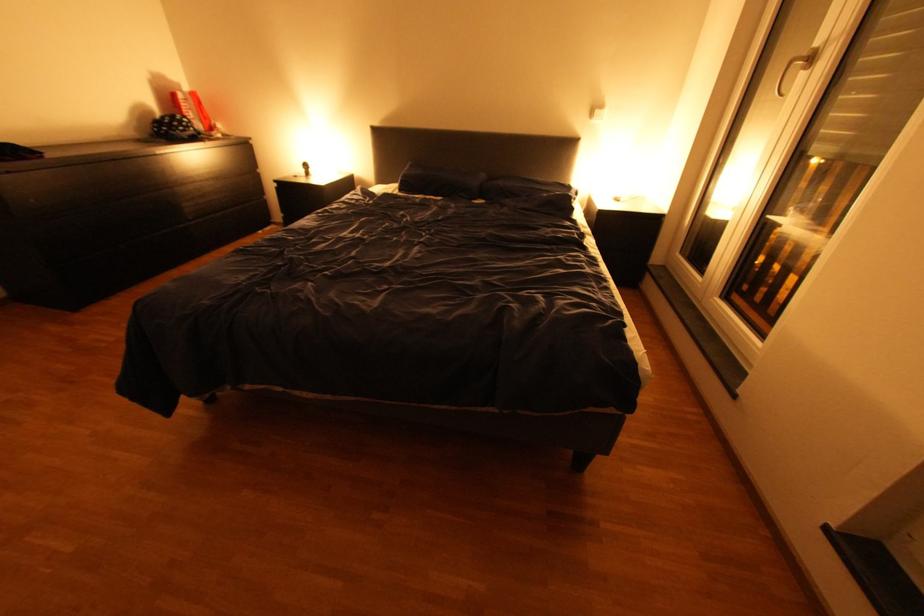
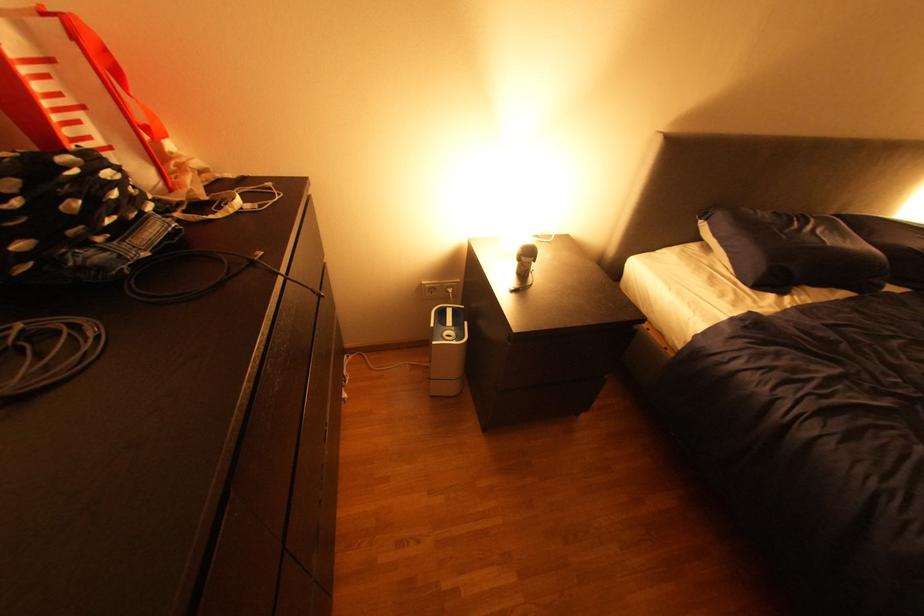
The images are taken continuously from a first-person perspective. In which direction are you moving?

The cameraman walked toward left, forward.